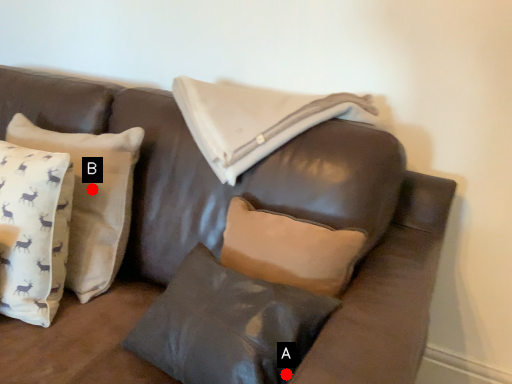
Question: Two points are circled on the image, labeled by A and B beside each circle. Which of the following is the closest to the observer?

Choices:
 (A) A is closer
 (B) B is closer

Answer: (A)